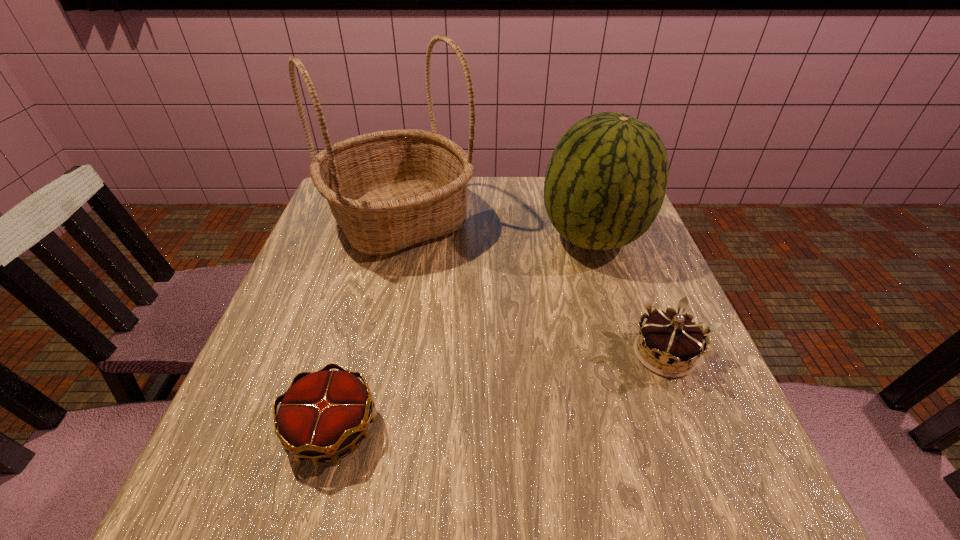
I want to click on the tallest object, so click(388, 190).

Image resolution: width=960 pixels, height=540 pixels. I want to click on watermelon, so click(605, 183).

Identify the location of the right crown. Image resolution: width=960 pixels, height=540 pixels. (671, 337).

This screenshot has width=960, height=540. In order to click on the second shortest object in this screenshot , I will do `click(671, 337)`.

Locate an element on the screen. the shorter crown is located at coordinates (323, 413).

Locate an element on the screen. The image size is (960, 540). the left crown is located at coordinates (323, 413).

At what (x,y) coordinates should I click in order to perform the action: click on vacant space situated 0.140m on the right of the tallest object. Please return your answer as a coordinate pair (x, y). Image resolution: width=960 pixels, height=540 pixels. Looking at the image, I should click on (530, 219).

The image size is (960, 540). Identify the location of blank space located on the front of the watermelon. (611, 294).

Where is `free space located on the left of the second nearest object`? Image resolution: width=960 pixels, height=540 pixels. free space located on the left of the second nearest object is located at coordinates (430, 354).

Locate an element on the screen. The height and width of the screenshot is (540, 960). vacant space situated 0.050m on the front of the left crown is located at coordinates (310, 509).